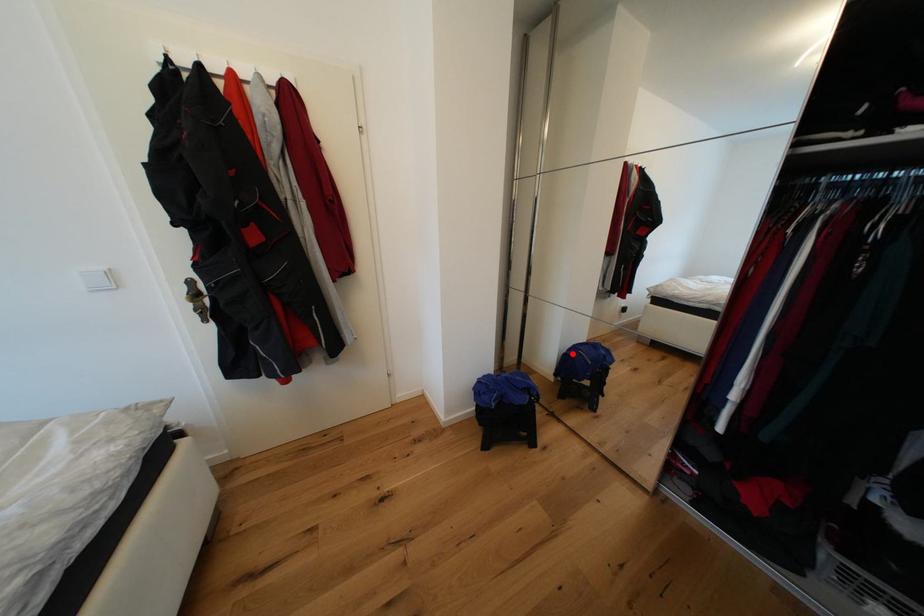
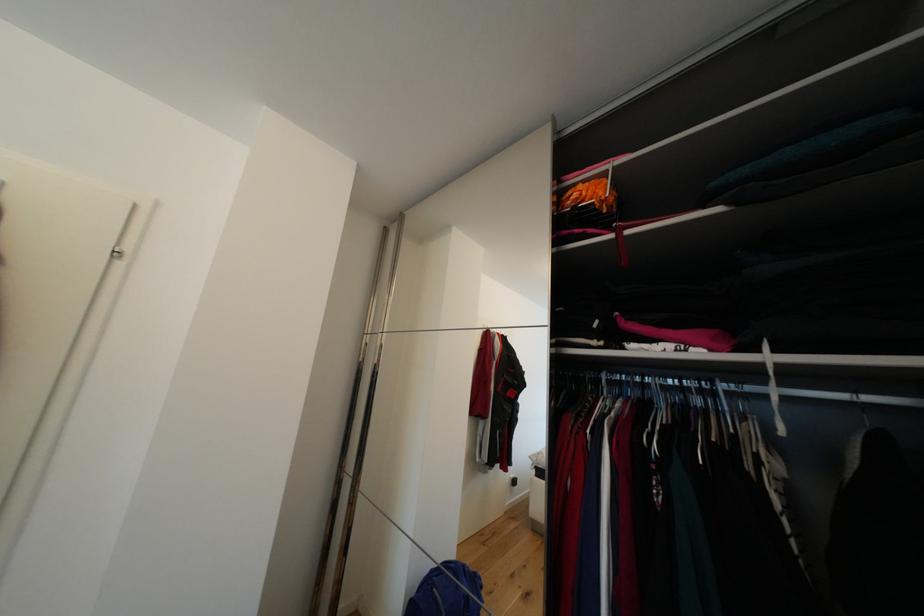
Question: I am providing you with two images of the same scene from different viewpoints. Given a red point in image1, look at the same physical point in image2. Is it:

Choices:
 (A) Closer to the viewpoint
 (B) Farther from the viewpoint

Answer: (B)